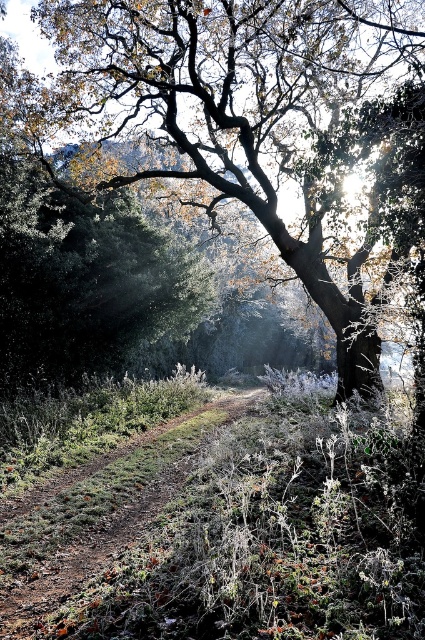
Question: Which point is closer to the camera?

Choices:
 (A) (118, 35)
 (B) (136, 458)

Answer: (B)

Question: Can you confirm if smooth brown tree trunk at center is positioned below brown dirt path at center?

Choices:
 (A) yes
 (B) no

Answer: (B)

Question: Can you confirm if smooth brown tree trunk at center is positioned below brown dirt path at center?

Choices:
 (A) yes
 (B) no

Answer: (B)

Question: Which of the following is the closest to the observer?

Choices:
 (A) smooth brown tree trunk at center
 (B) brown dirt path at center

Answer: (B)

Question: Observing the image, what is the correct spatial positioning of smooth brown tree trunk at center in reference to brown dirt path at center?

Choices:
 (A) left
 (B) right

Answer: (B)